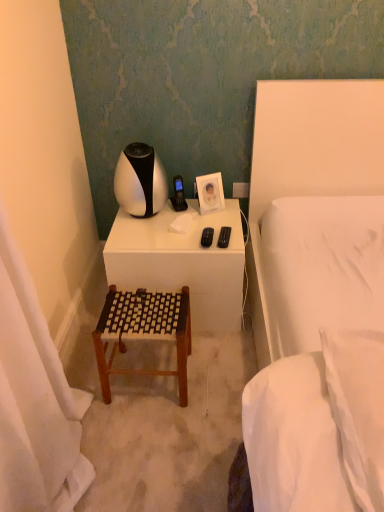
This screenshot has height=512, width=384. Identify the location of vacant area that is in front of white matte desk at center. (198, 378).